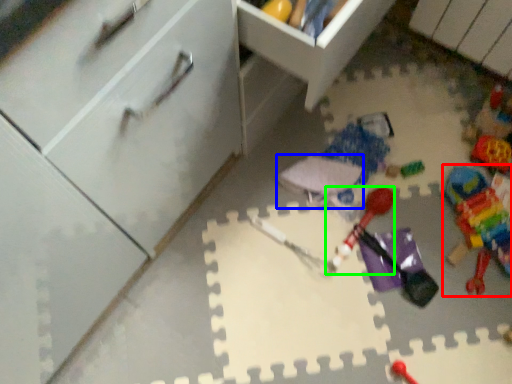
Question: Which object is the farthest from toy (highlighted by a red box)? Choose among these: toy (highlighted by a blue box) or toy (highlighted by a green box).

Choices:
 (A) toy
 (B) toy

Answer: (A)